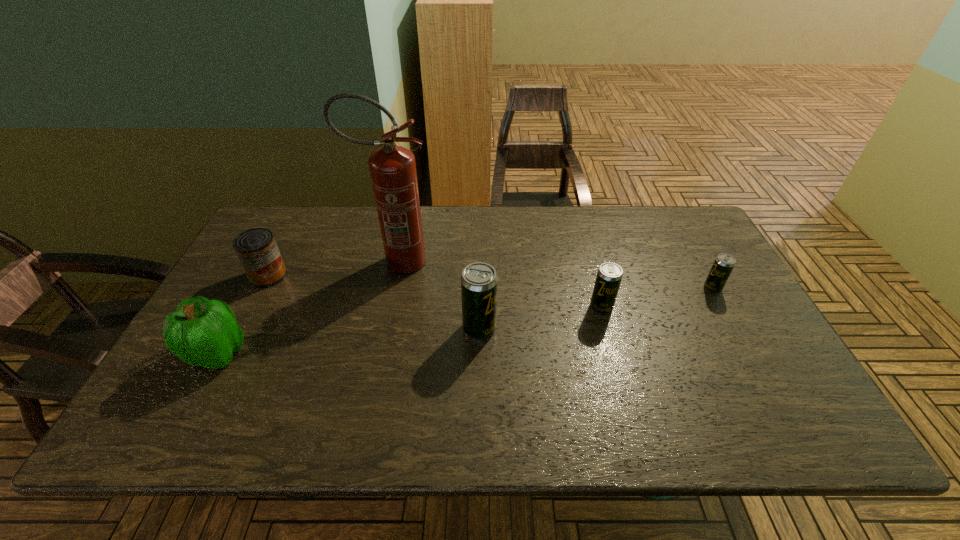
Where is `vacant space that satisfies the following two spatial constraints: 1. on the back side of the bell pepper; 2. on the left side of the shortest object`? vacant space that satisfies the following two spatial constraints: 1. on the back side of the bell pepper; 2. on the left side of the shortest object is located at coordinates (252, 288).

Where is `free space that satisfies the following two spatial constraints: 1. on the front side of the fourth object from left to right; 2. on the right side of the can`? This screenshot has width=960, height=540. free space that satisfies the following two spatial constraints: 1. on the front side of the fourth object from left to right; 2. on the right side of the can is located at coordinates coord(241,328).

Locate an element on the screen. blank area in the image that satisfies the following two spatial constraints: 1. on the back side of the nearest beer can; 2. from the nozzle of the tallest object is located at coordinates (479, 262).

At what (x,y) coordinates should I click in order to perform the action: click on free space in the image that satisfies the following two spatial constraints: 1. on the front side of the nearest beer can; 2. on the left side of the can. Please return your answer as a coordinate pair (x, y). This screenshot has height=540, width=960. Looking at the image, I should click on (241, 328).

Where is `free point that satisfies the following two spatial constraints: 1. from the nozzle of the fourth object from right to left; 2. on the right side of the tallest beer can`? The width and height of the screenshot is (960, 540). free point that satisfies the following two spatial constraints: 1. from the nozzle of the fourth object from right to left; 2. on the right side of the tallest beer can is located at coordinates (382, 328).

Image resolution: width=960 pixels, height=540 pixels. In order to click on vacant position in the image that satisfies the following two spatial constraints: 1. from the nozzle of the fourth object from left to right; 2. on the left side of the fire extinguisher in this screenshot , I will do `click(382, 328)`.

This screenshot has height=540, width=960. I want to click on blank space that satisfies the following two spatial constraints: 1. from the nozzle of the farthest beer can; 2. on the right side of the fire extinguisher, so (391, 288).